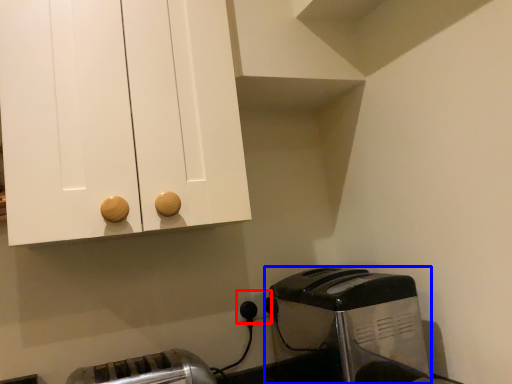
Question: Which object appears farthest to the camera in this image, electric outlet (highlighted by a red box) or toaster (highlighted by a blue box)?

Choices:
 (A) electric outlet
 (B) toaster

Answer: (A)